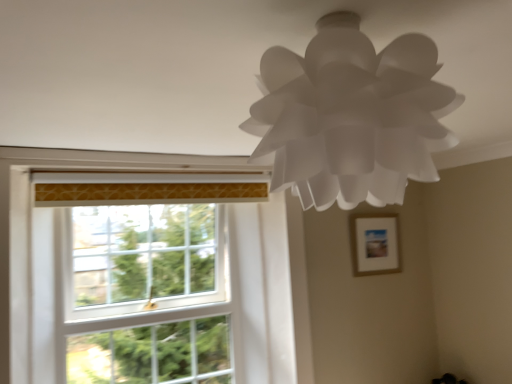
Question: Is white glass window screen at left positioned in front of white paper lamp at upper center?

Choices:
 (A) yes
 (B) no

Answer: (B)

Question: Is white glass window screen at left turned away from white paper lamp at upper center?

Choices:
 (A) yes
 (B) no

Answer: (B)

Question: Can you confirm if white glass window screen at left is positioned to the right of white paper lamp at upper center?

Choices:
 (A) no
 (B) yes

Answer: (A)

Question: From a real-world perspective, is white glass window screen at left physically above white paper lamp at upper center?

Choices:
 (A) yes
 (B) no

Answer: (B)

Question: Considering the relative sizes of white glass window screen at left and white paper lamp at upper center in the image provided, is white glass window screen at left wider than white paper lamp at upper center?

Choices:
 (A) yes
 (B) no

Answer: (B)

Question: Does white glass window screen at left have a lesser height compared to white paper lamp at upper center?

Choices:
 (A) yes
 (B) no

Answer: (B)

Question: Is white paper lamp at upper center looking in the opposite direction of white glass window screen at left?

Choices:
 (A) no
 (B) yes

Answer: (B)

Question: Is white paper lamp at upper center with white glass window screen at left?

Choices:
 (A) yes
 (B) no

Answer: (B)

Question: Is the position of white paper lamp at upper center less distant than that of white glass window screen at left?

Choices:
 (A) yes
 (B) no

Answer: (A)

Question: From a real-world perspective, is white paper lamp at upper center beneath white glass window screen at left?

Choices:
 (A) yes
 (B) no

Answer: (B)

Question: Is white paper lamp at upper center shorter than white glass window screen at left?

Choices:
 (A) yes
 (B) no

Answer: (A)

Question: Is white paper lamp at upper center aimed at white glass window screen at left?

Choices:
 (A) no
 (B) yes

Answer: (A)

Question: Can you confirm if wooden picture frame at upper right is taller than white glass window screen at left?

Choices:
 (A) no
 (B) yes

Answer: (A)